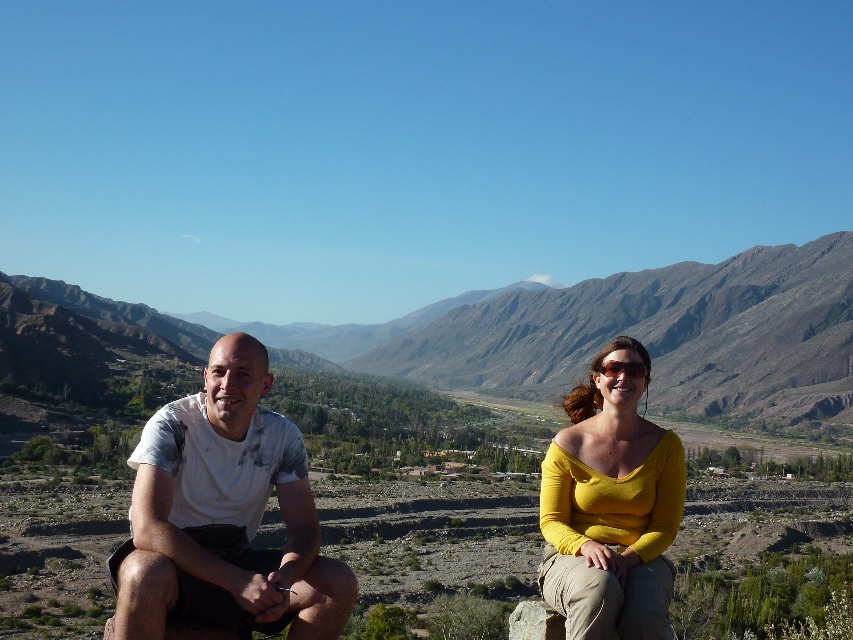
You are a photographer planning to take a photo of the two people sitting on the rocky outcrop. You want to ensure that the brown rocky mountain at center is clearly visible in the background. Based on their current positions, will the mountain be in the frame if you position the camera at the same level as their heads?

The brown rocky mountain at center is located at point (659, 333) in the image, which is towards the upper middle section of the frame. Since the camera is positioned at the same level as their heads, the mountain should be visible in the background as long as the camera angle is not too low or obstructed by the subjects.